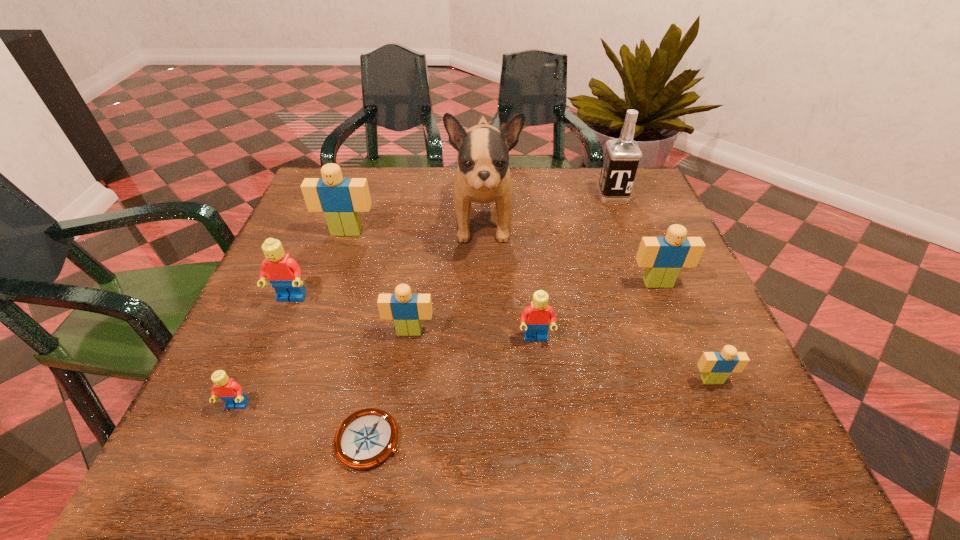
Locate an element on the screen. Image resolution: width=960 pixels, height=540 pixels. puppy is located at coordinates (483, 176).

This screenshot has height=540, width=960. In order to click on vodka in this screenshot , I will do `click(622, 155)`.

Image resolution: width=960 pixels, height=540 pixels. What are the coordinates of `the farthest Lego` in the screenshot? It's located at [x=341, y=199].

At what (x,y) coordinates should I click in order to perform the action: click on the biggest beige Lego. Please return your answer as a coordinate pair (x, y). The width and height of the screenshot is (960, 540). Looking at the image, I should click on (341, 199).

This screenshot has height=540, width=960. Identify the location of the fourth farthest object. (663, 257).

What are the coordinates of `the third smallest beige Lego` in the screenshot? It's located at (663, 257).

Where is `the farthest red Lego`? The width and height of the screenshot is (960, 540). the farthest red Lego is located at coordinates 284,274.

At what (x,y) coordinates should I click in order to perform the action: click on the fifth farthest object. Please return your answer as a coordinate pair (x, y). The width and height of the screenshot is (960, 540). Looking at the image, I should click on (284, 274).

Where is `the second smallest beige Lego`? the second smallest beige Lego is located at coordinates (407, 310).

At what (x,y) coordinates should I click in order to perform the action: click on the third farthest beige Lego. Please return your answer as a coordinate pair (x, y). Looking at the image, I should click on (407, 310).